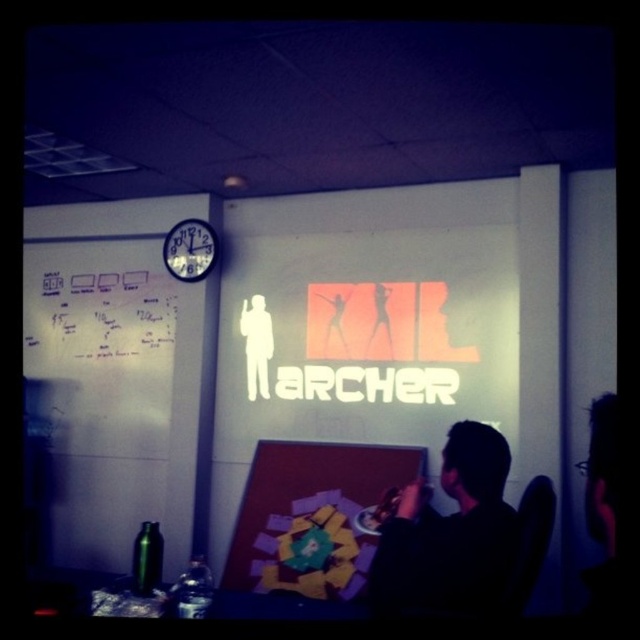
Question: Can you confirm if black leather chair at lower right is wider than white plastic clock at upper left?

Choices:
 (A) no
 (B) yes

Answer: (A)

Question: Which point appears farthest from the camera in this image?

Choices:
 (A) (515, 563)
 (B) (413, 554)

Answer: (B)

Question: Does black matte shirt at lower right have a smaller size compared to black leather chair at lower right?

Choices:
 (A) yes
 (B) no

Answer: (B)

Question: Which object is the farthest from the white plastic clock at upper left?

Choices:
 (A) black matte shirt at lower right
 (B) black leather chair at lower right

Answer: (B)

Question: Does black leather chair at lower right have a lesser width compared to white plastic clock at upper left?

Choices:
 (A) yes
 (B) no

Answer: (A)

Question: Which object is the farthest from the black matte shirt at lower right?

Choices:
 (A) white plastic clock at upper left
 (B) black leather chair at lower right

Answer: (A)